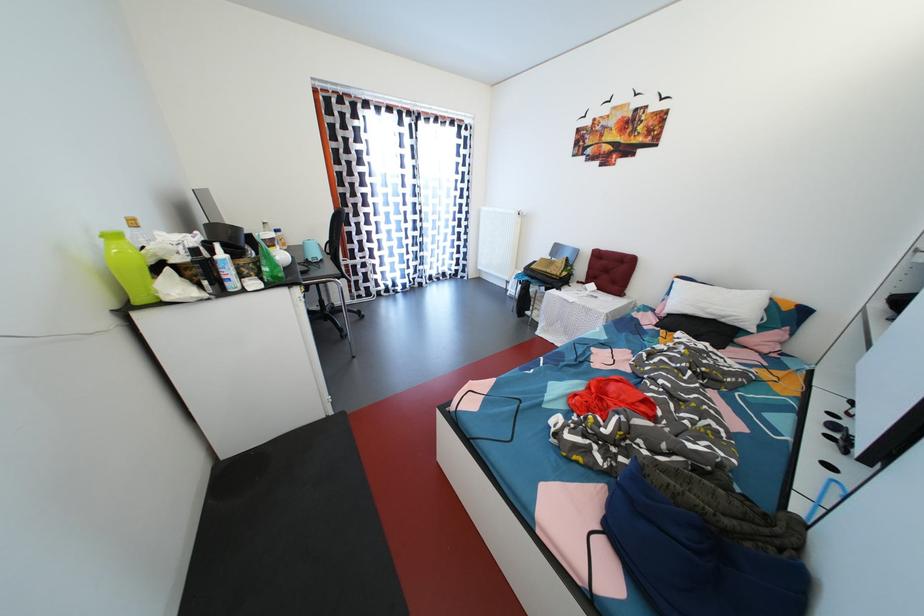
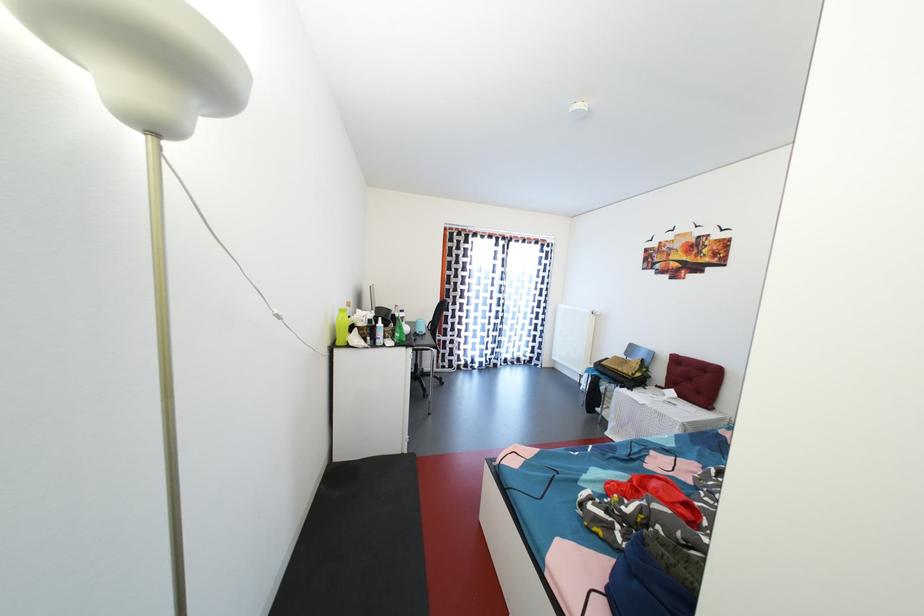
Find the pixel in the second image that matches [249,267] in the first image.

(394, 334)